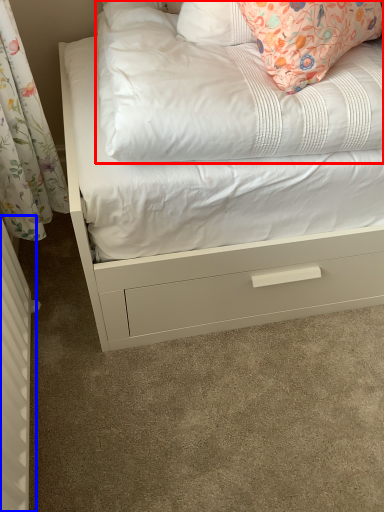
Question: Which object appears farthest to the camera in this image, mattress (highlighted by a red box) or radiator (highlighted by a blue box)?

Choices:
 (A) mattress
 (B) radiator

Answer: (A)